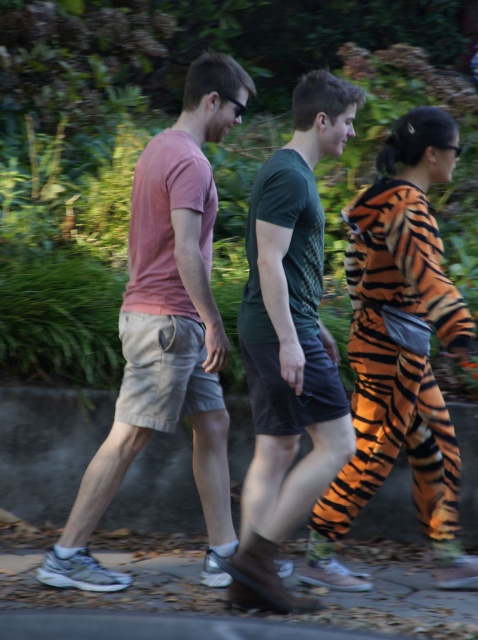
Between orange tiger print onesie at center and brown stone pavement at lower center, which one has less height?

With less height is brown stone pavement at lower center.

Which is in front, point (390, 252) or point (420, 604)?

Point (420, 604) is in front.

Does point (425, 154) come farther from viewer compared to point (217, 595)?

That is True.

At what (x,y) coordinates should I click in order to perform the action: click on orange tiger print onesie at center. Please return your answer as a coordinate pair (x, y). The height and width of the screenshot is (640, 478). Looking at the image, I should click on (399, 355).

Is matte pink t-shirt at center above orange tiger print onesie at center?

Correct, matte pink t-shirt at center is located above orange tiger print onesie at center.

Between matte pink t-shirt at center and orange tiger print onesie at center, which one is positioned higher?

Positioned higher is matte pink t-shirt at center.

Find the location of a particular element. This screenshot has height=640, width=478. matte pink t-shirt at center is located at coordinates (166, 326).

Does matte pink t-shirt at center have a greater width compared to brown stone pavement at lower center?

Incorrect, matte pink t-shirt at center's width does not surpass brown stone pavement at lower center's.

Is matte pink t-shirt at center in front of brown stone pavement at lower center?

No, it is not.

The image size is (478, 640). What do you see at coordinates (166, 326) in the screenshot? I see `matte pink t-shirt at center` at bounding box center [166, 326].

This screenshot has height=640, width=478. I want to click on matte pink t-shirt at center, so click(166, 326).